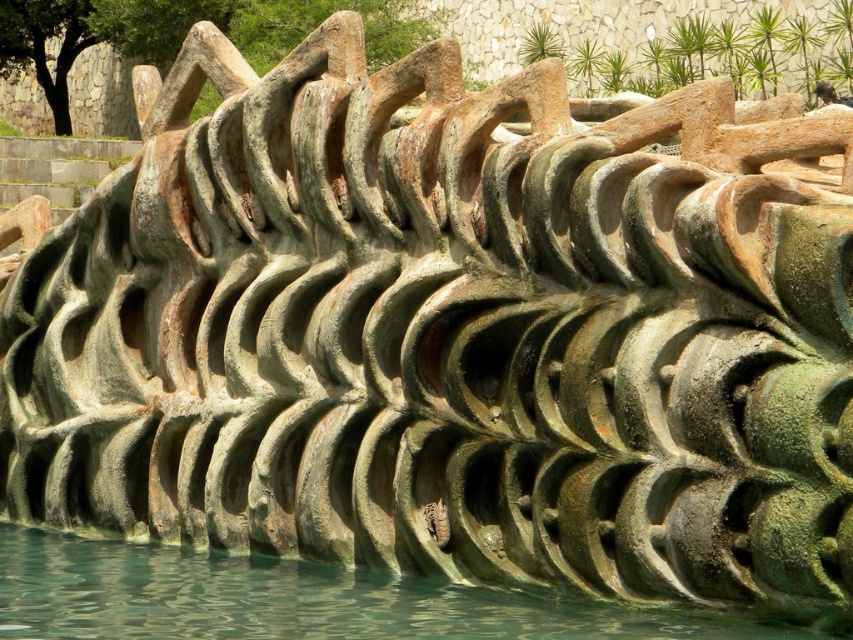
Question: Is greenish water at bottom to the left of shiny metallic snake at center from the viewer's perspective?

Choices:
 (A) no
 (B) yes

Answer: (B)

Question: Is greenish water at bottom below shiny metallic snake at center?

Choices:
 (A) yes
 (B) no

Answer: (A)

Question: Which of the following is the farthest from the observer?

Choices:
 (A) (102, 600)
 (B) (445, 536)

Answer: (A)

Question: Is greenish water at bottom bigger than shiny metallic snake at center?

Choices:
 (A) yes
 (B) no

Answer: (A)